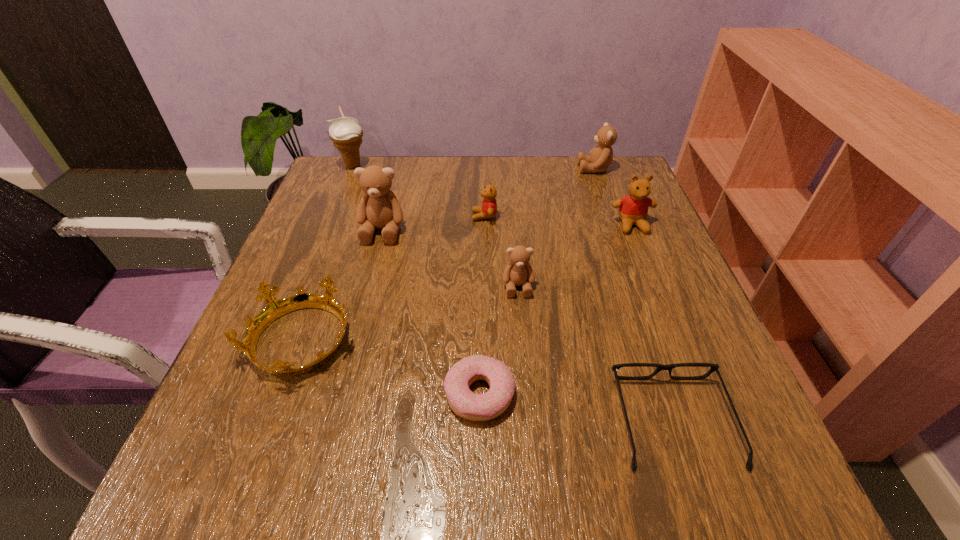
Find the location of a particular element. This screenshot has width=960, height=540. free space between the gold crown and the nearest teddy bear is located at coordinates (410, 314).

Locate an element on the screen. The height and width of the screenshot is (540, 960). free spot between the second biggest brown teddy bear and the pink doughnut is located at coordinates (537, 281).

The width and height of the screenshot is (960, 540). I want to click on free space between the spectacles and the second teddy bear from left to right, so click(x=579, y=319).

Choose which object is the third nearest neighbor to the spectacles. Please provide its 2D coordinates. Your answer should be formatted as a tuple, i.e. [(x, y)], where the tuple contains the x and y coordinates of a point satisfying the conditions above.

[(633, 209)]

You are a GUI agent. You are given a task and a screenshot of the screen. Output one action in this format:
    pyautogui.click(x=<x>, y=<y>)
    Task: Click on the object that is the fifth closest one to the spectacles
    This screenshot has height=540, width=960.
    Given the screenshot: What is the action you would take?
    pyautogui.click(x=488, y=210)

Find the location of `teddy bear that is the closest to the bigger red teddy bear`. teddy bear that is the closest to the bigger red teddy bear is located at coordinates (600, 157).

Choose which teddy bear is the fourth nearest neighbor to the right red teddy bear. Please provide its 2D coordinates. Your answer should be formatted as a tuple, i.e. [(x, y)], where the tuple contains the x and y coordinates of a point satisfying the conditions above.

[(379, 208)]

Where is `brown teddy bear that stands as the closest to the right red teddy bear`? This screenshot has height=540, width=960. brown teddy bear that stands as the closest to the right red teddy bear is located at coordinates (600, 157).

Point out which brown teddy bear is positioned as the third nearest to the smaller red teddy bear. Please provide its 2D coordinates. Your answer should be formatted as a tuple, i.e. [(x, y)], where the tuple contains the x and y coordinates of a point satisfying the conditions above.

[(600, 157)]

Identify the location of free space that satisfies the following two spatial constraints: 1. on the front-facing side of the rightmost brown teddy bear; 2. on the front-facing side of the smallest brown teddy bear. The height and width of the screenshot is (540, 960). (636, 286).